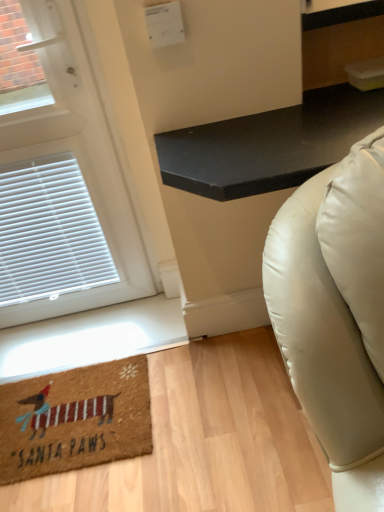
The height and width of the screenshot is (512, 384). I want to click on free space above black matte table at upper right (from a real-world perspective), so click(x=278, y=124).